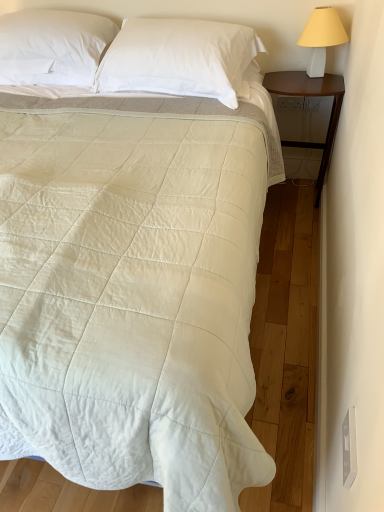
Question: From a real-world perspective, relative to white smooth pillow at upper center, the first pillow in the left-to-right sequence, is white smooth pillow at upper center, which ranks as the 1th pillow in right-to-left order, vertically above or below?

Choices:
 (A) below
 (B) above

Answer: (A)

Question: Is white smooth pillow at upper center, which ranks as the 1th pillow in right-to-left order, to the left or to the right of white smooth pillow at upper center, the first pillow in the left-to-right sequence, in the image?

Choices:
 (A) right
 (B) left

Answer: (A)

Question: Based on their relative distances, which object is farther from the white ceramic lampshade at upper right?

Choices:
 (A) white smooth pillow at upper center, marked as the second pillow in a left-to-right arrangement
 (B) white smooth pillow at upper center, the first pillow in the left-to-right sequence
 (C) white quilted fabric bed at center
 (D) dark wood nightstand at right

Answer: (B)

Question: Based on their relative distances, which object is farther from the white quilted fabric bed at center?

Choices:
 (A) white smooth pillow at upper center, marked as the second pillow in a left-to-right arrangement
 (B) dark wood nightstand at right
 (C) white smooth pillow at upper center, the first pillow in the left-to-right sequence
 (D) white ceramic lampshade at upper right

Answer: (D)